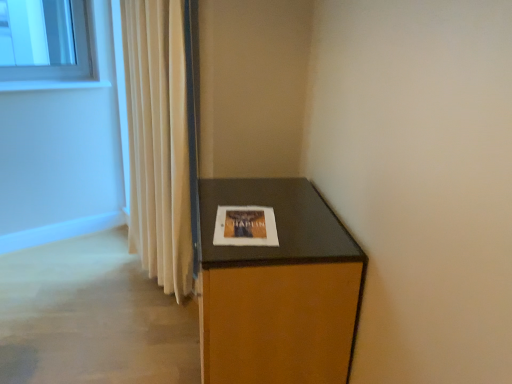
Find the location of a particular element. Image resolution: width=512 pixels, height=384 pixels. free space on the front side of beige fabric curtain at left is located at coordinates (143, 326).